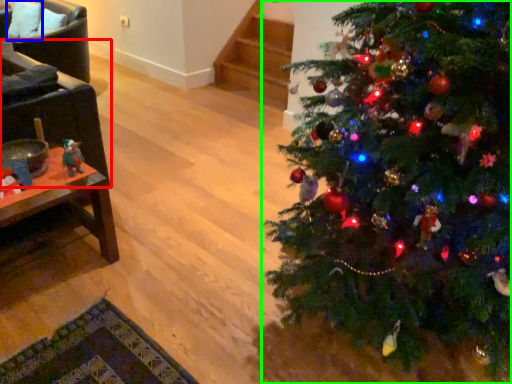
Question: Considering the real-world distances, which object is farthest from armchair (highlighted by a red box)? pillow (highlighted by a blue box) or christmas tree (highlighted by a green box)?

Choices:
 (A) pillow
 (B) christmas tree

Answer: (A)